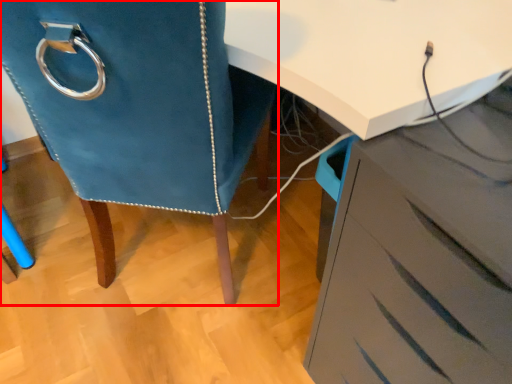
Question: From the image's perspective, where is furniture (annotated by the red box) located in relation to chest of drawers in the image?

Choices:
 (A) below
 (B) above

Answer: (B)